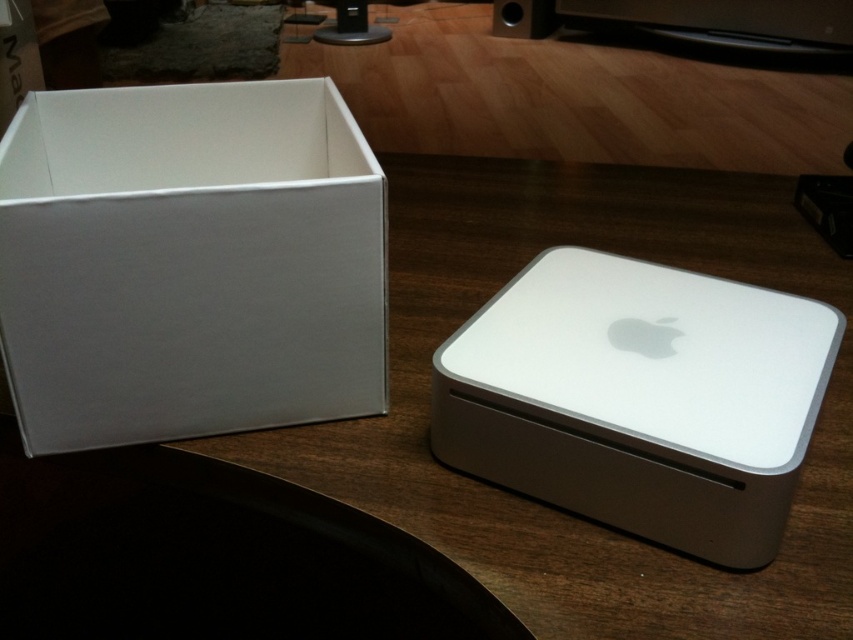
Question: Which object appears farthest from the camera in this image?

Choices:
 (A) white matte apple mac mini at center
 (B) white cardboard box at upper left

Answer: (B)

Question: Which point is farther from the camera taking this photo?

Choices:
 (A) (563, 506)
 (B) (131, 125)
 (C) (527, 12)

Answer: (C)

Question: Can you confirm if white cardboard box at upper left is thinner than matte black speaker at upper center?

Choices:
 (A) yes
 (B) no

Answer: (B)

Question: Which of the following is the closest to the observer?

Choices:
 (A) matte black speaker at upper center
 (B) white cardboard box at upper left
 (C) white matte apple mac mini at center

Answer: (C)

Question: Is white cardboard box at upper left wider than white matte apple mac mini at center?

Choices:
 (A) yes
 (B) no

Answer: (A)

Question: Is white cardboard box at upper left behind white matte apple mac mini at center?

Choices:
 (A) no
 (B) yes

Answer: (B)